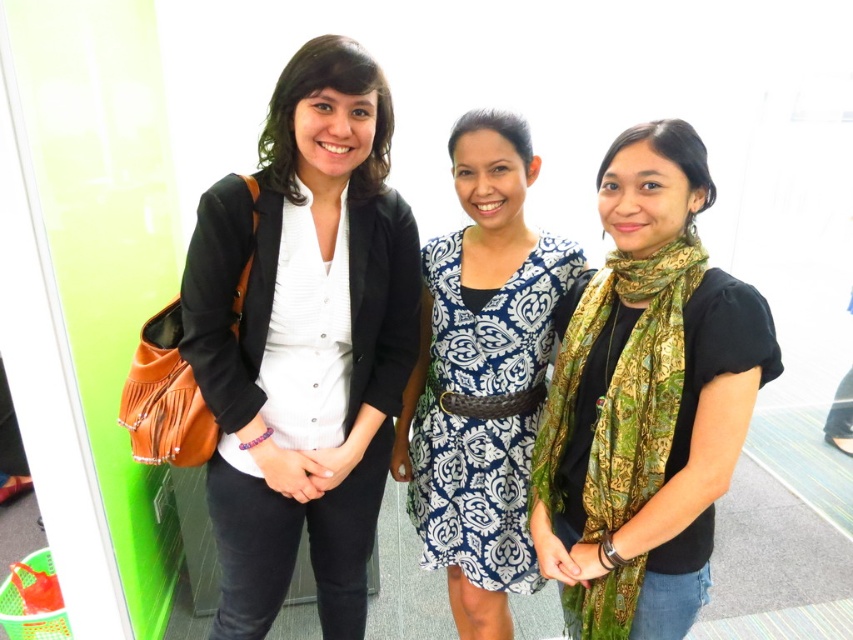
You are a fashion stylist observing the three women in the image. You need to determine which item is visible on top between the matte black blazer at center and the green silk scarf at center. Which one is on top?

The matte black blazer at center is positioned over the green silk scarf at center, so the matte black blazer at center is on top.

Based on the photo, you are a photographer trying to capture the blue printed fabric dress at center and the green silk scarf at center in a single frame. Which object should you focus on first to ensure both are in the frame?

The blue printed fabric dress at center is located above the green silk scarf at center, so you should focus on the blue printed fabric dress at center first to ensure both are in the frame.

You are organizing a photoshoot and need to arrange the models according to their clothing. The scene has a blue printed fabric dress at center and a green silk scarf at center. Which clothing item is positioned to the left of the other?

The blue printed fabric dress at center is to the left of the green silk scarf at center.